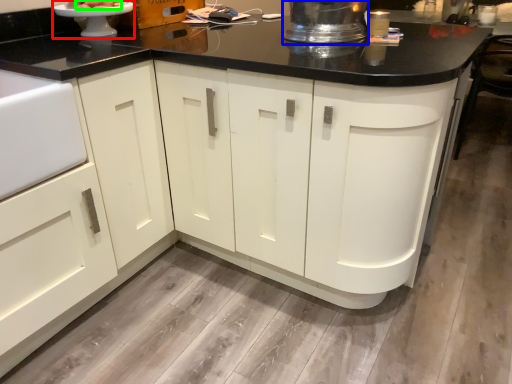
Question: Which object is the closest to the appliance (highlighted by a red box)? Choose among these: appliance (highlighted by a blue box) or food (highlighted by a green box).

Choices:
 (A) appliance
 (B) food

Answer: (B)